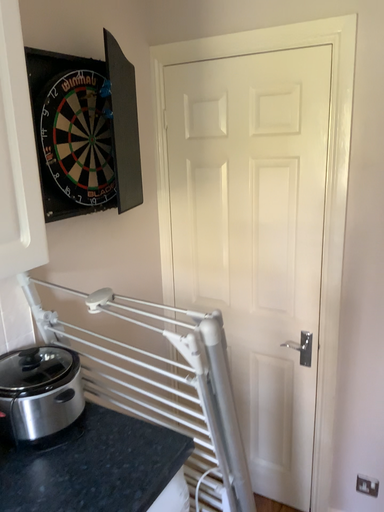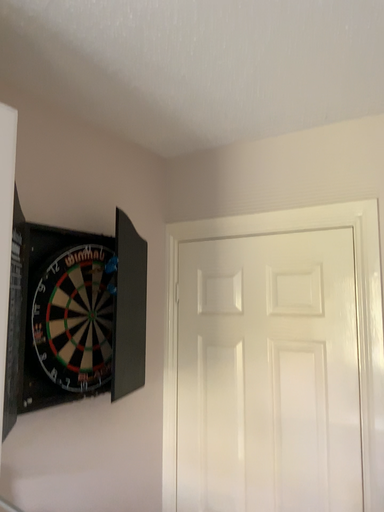
Question: How did the camera likely rotate when shooting the video?

Choices:
 (A) rotated upward
 (B) rotated downward

Answer: (A)